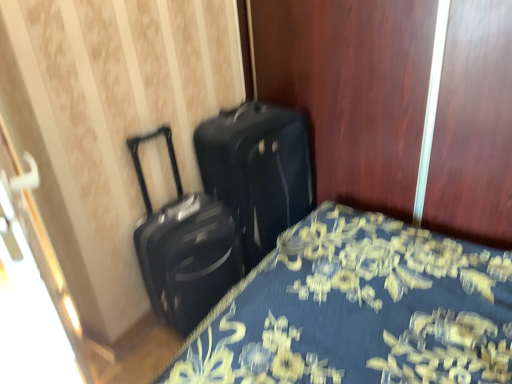
Question: Looking at their shapes, would you say blue floral fabric bed at lower left is wider or thinner than black matte suitcase at center, the second suitcase when ordered from right to left?

Choices:
 (A) wide
 (B) thin

Answer: (A)

Question: Visually, is blue floral fabric bed at lower left positioned to the left or to the right of black matte suitcase at center, the second suitcase when ordered from right to left?

Choices:
 (A) right
 (B) left

Answer: (A)

Question: Which object is positioned closest to the blue floral fabric bed at lower left?

Choices:
 (A) black matte suitcase at center, the second suitcase when ordered from right to left
 (B) black matte suitcase at center, arranged as the second suitcase when viewed from the left

Answer: (B)

Question: Which of these objects is positioned closest to the blue floral fabric bed at lower left?

Choices:
 (A) black matte suitcase at center, the second suitcase when ordered from right to left
 (B) black matte suitcase at center, arranged as the 1th suitcase when viewed from the right

Answer: (B)